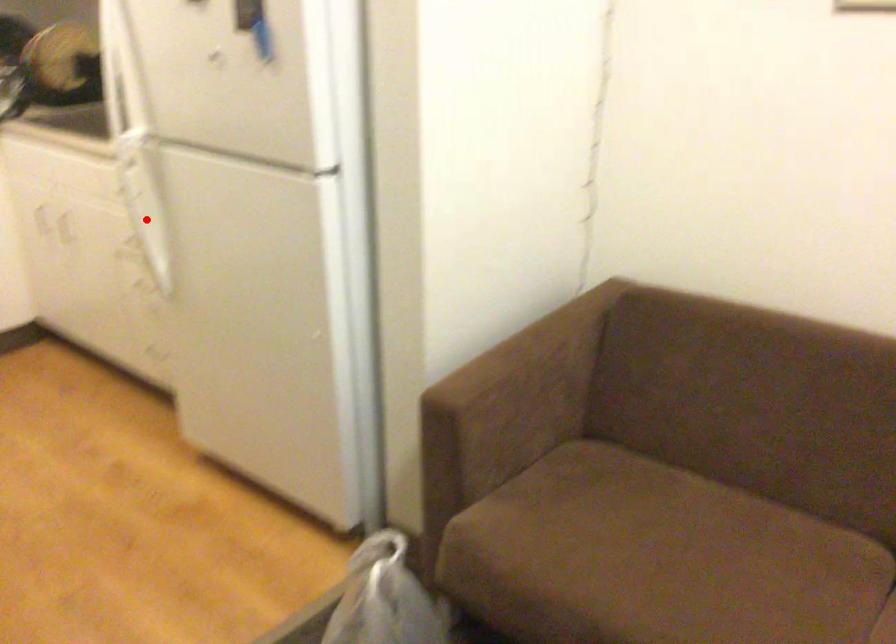
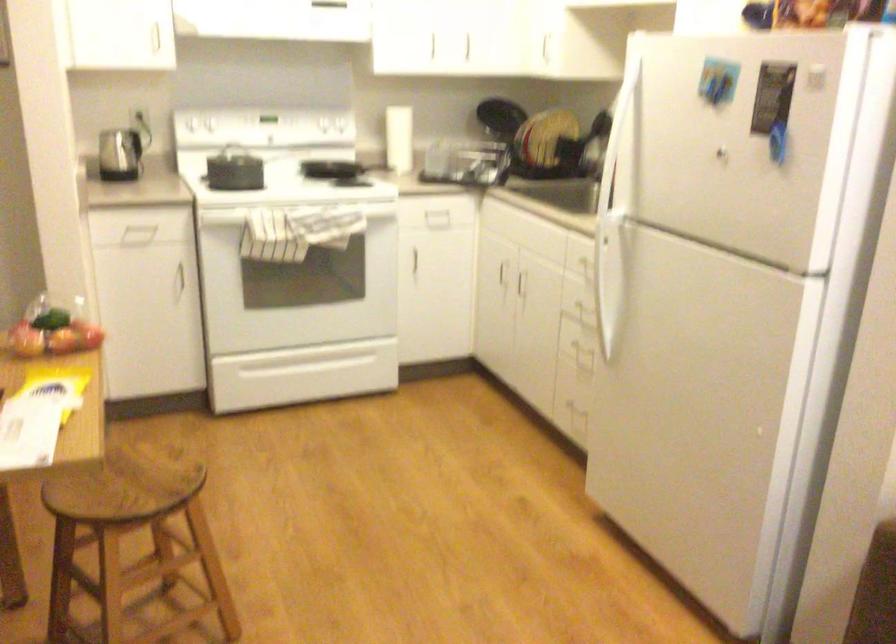
Find the pixel in the second image that matches the highlighted location in the first image.

(607, 283)